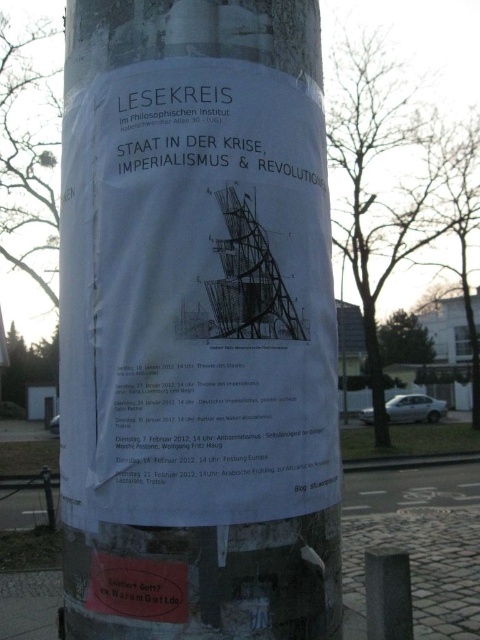
Question: Does white paper poster at center have a lesser width compared to black stone post at lower right?

Choices:
 (A) no
 (B) yes

Answer: (A)

Question: Can you confirm if white paper poster at center is positioned to the left of black stone post at lower right?

Choices:
 (A) yes
 (B) no

Answer: (A)

Question: Can you confirm if white paper poster at center is thinner than black stone post at lower right?

Choices:
 (A) no
 (B) yes

Answer: (A)

Question: Which point is farther from the camera taking this photo?

Choices:
 (A) (374, 598)
 (B) (219, 177)

Answer: (A)